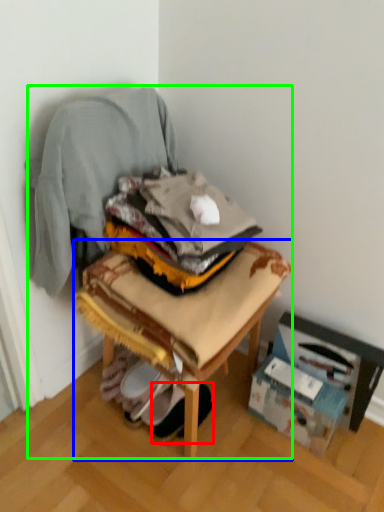
Question: Estimate the real-world distances between objects in this image. Which object is closer to footwear (highlighted by a red box), furniture (highlighted by a blue box) or chair (highlighted by a green box)?

Choices:
 (A) furniture
 (B) chair

Answer: (A)